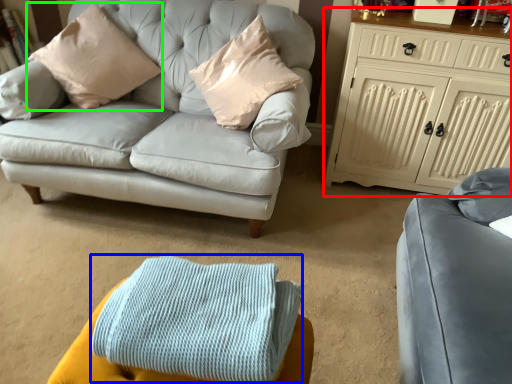
Question: Considering the real-world distances, which object is farthest from cabinetry (highlighted by a red box)? blanket (highlighted by a blue box) or pillow (highlighted by a green box)?

Choices:
 (A) blanket
 (B) pillow

Answer: (A)